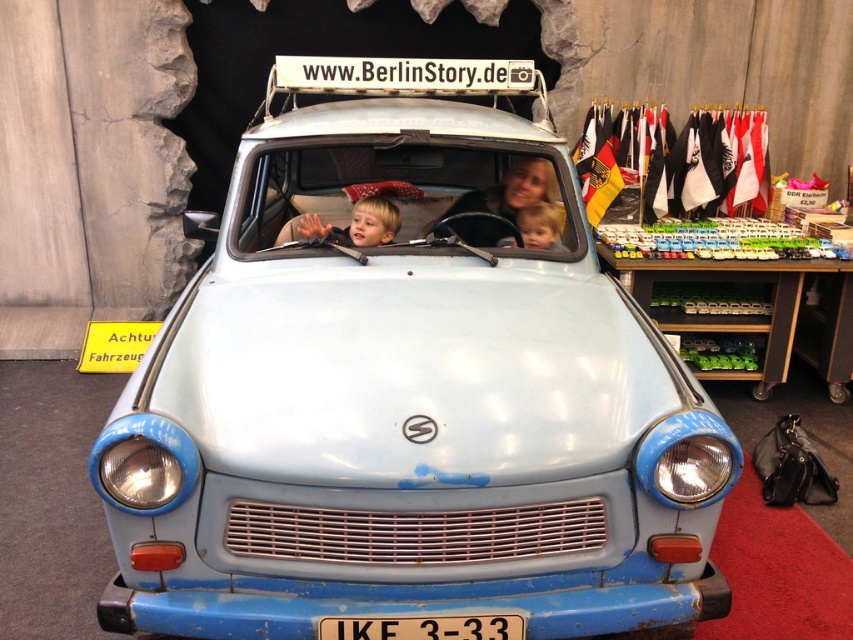
Question: Observing the image, what is the correct spatial positioning of light blue matte car at center in reference to black plastic license plate at center?

Choices:
 (A) right
 (B) left

Answer: (B)

Question: Is light blue matte car at center positioned behind black plastic license plate at center?

Choices:
 (A) yes
 (B) no

Answer: (B)

Question: Is light blue matte car at center closer to camera compared to blonde hair child at center?

Choices:
 (A) yes
 (B) no

Answer: (A)

Question: Estimate the real-world distances between objects in this image. Which object is farther from the blonde hair child at center?

Choices:
 (A) black plastic license plate at center
 (B) matte blue boy at center

Answer: (A)

Question: Estimate the real-world distances between objects in this image. Which object is closer to the black plastic license plate at center?

Choices:
 (A) blonde hair child at center
 (B) matte blue boy at center

Answer: (B)

Question: Based on their relative distances, which object is farther from the black plastic license plate at center?

Choices:
 (A) light blue matte car at center
 (B) matte blue boy at center

Answer: (B)